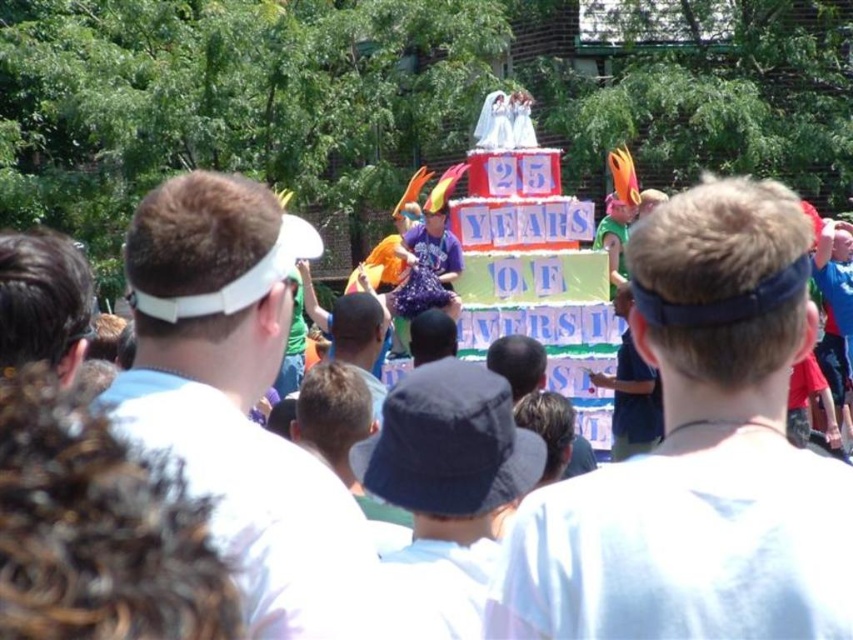
Question: Can you confirm if purple fabric at center is smaller than dark blue fabric cap at center?

Choices:
 (A) no
 (B) yes

Answer: (A)

Question: Among these points, which one is farthest from the camera?

Choices:
 (A) (650, 435)
 (B) (85, 285)
 (C) (614, 248)

Answer: (C)

Question: Which point is closer to the camera?

Choices:
 (A) (144, 372)
 (B) (740, 273)

Answer: (B)

Question: Which point is farther to the camera?

Choices:
 (A) (625, 381)
 (B) (6, 336)
 (C) (704, 618)

Answer: (A)

Question: In this image, where is white fabric visor at left located relative to dark blue fabric bucket hat at center?

Choices:
 (A) above
 (B) below

Answer: (A)

Question: Can you confirm if white fabric visor at left is thinner than white visor at left?

Choices:
 (A) yes
 (B) no

Answer: (B)